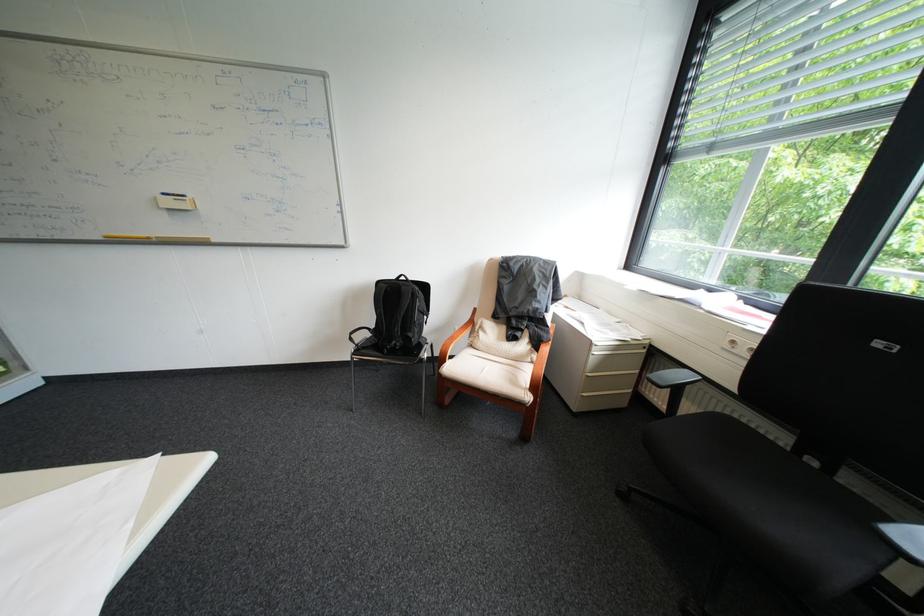
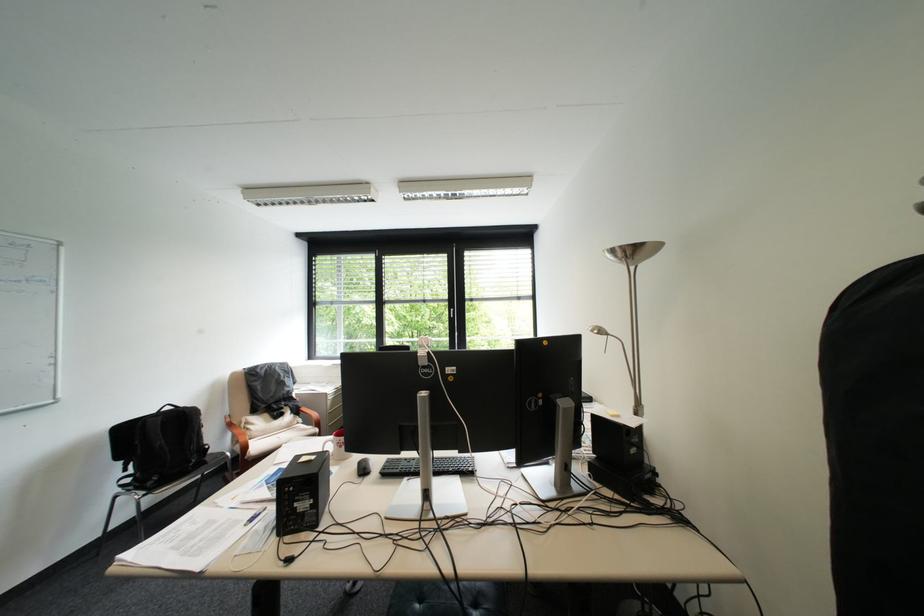
In the second image, find the point that corresponds to pixel 490 326 in the first image.

(256, 424)